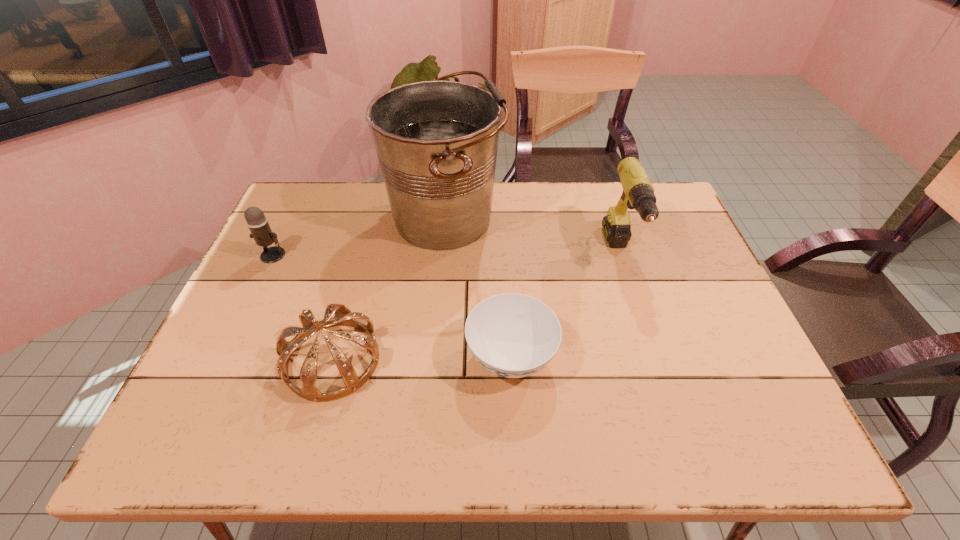
Where is `empty location between the chinaware and the leftmost object`? The width and height of the screenshot is (960, 540). empty location between the chinaware and the leftmost object is located at coordinates (392, 306).

Identify the location of vacant area that lies between the chinaware and the leftmost object. (392, 306).

Image resolution: width=960 pixels, height=540 pixels. Identify the location of vacant area between the leftmost object and the tallest object. (359, 237).

Identify the location of unoccupied position between the chinaware and the second shortest object. (421, 359).

The image size is (960, 540). I want to click on empty location between the tiara and the bucket, so click(x=389, y=289).

Identify the location of vacant region between the drill and the bucket. (533, 236).

This screenshot has width=960, height=540. Find the location of `vacant region between the shortest object and the tallest object`. vacant region between the shortest object and the tallest object is located at coordinates (478, 288).

Locate which object ranks fourth in proximity to the tiara. Please provide its 2D coordinates. Your answer should be formatted as a tuple, i.e. [(x, y)], where the tuple contains the x and y coordinates of a point satisfying the conditions above.

[(638, 193)]

Select which object is the third closest to the tallest object. Please provide its 2D coordinates. Your answer should be formatted as a tuple, i.e. [(x, y)], where the tuple contains the x and y coordinates of a point satisfying the conditions above.

[(257, 223)]

Locate an element on the screen. The height and width of the screenshot is (540, 960). vacant space that satisfies the following two spatial constraints: 1. on the front side of the microphone; 2. on the right side of the tiara is located at coordinates (224, 360).